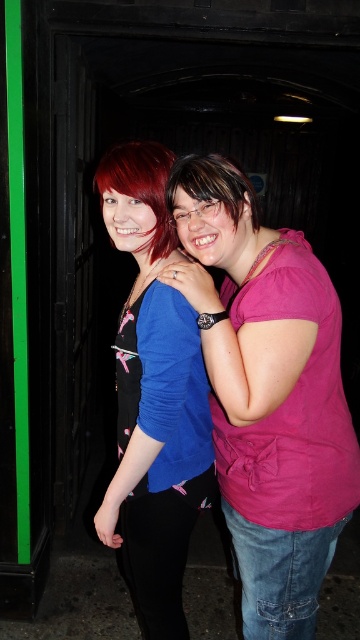
Question: Can you confirm if pink matte shirt at center is wider than shiny red hair at center?

Choices:
 (A) yes
 (B) no

Answer: (A)

Question: In this image, where is pink matte shirt at center located relative to shiny red hair at center?

Choices:
 (A) above
 (B) below

Answer: (B)

Question: Which point is closer to the camera?

Choices:
 (A) matte pink shirt at center
 (B) shiny red hair at center
 (C) blue fabric shirt at center
 (D) pink matte shirt at center

Answer: (D)

Question: From the image, what is the correct spatial relationship of blue fabric shirt at center in relation to shiny red hair at center?

Choices:
 (A) above
 (B) below

Answer: (B)

Question: Which of the following is the closest to the observer?

Choices:
 (A) pink matte shirt at center
 (B) blue fabric shirt at center
 (C) shiny red hair at center

Answer: (A)

Question: Among these points, which one is nearest to the camera?

Choices:
 (A) (163, 170)
 (B) (150, 552)
 (C) (236, 204)

Answer: (C)